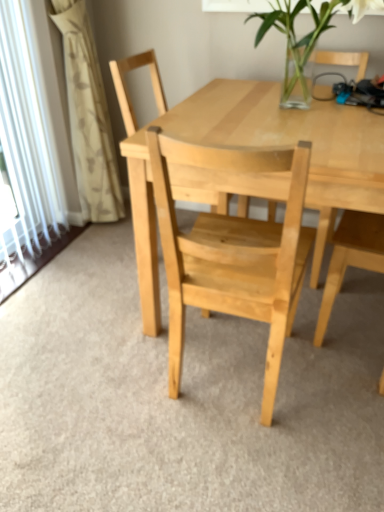
Question: Is natural wood table at center smaller than white textured curtain at left?

Choices:
 (A) no
 (B) yes

Answer: (A)

Question: Is white textured curtain at left completely or partially inside natural wood table at center?

Choices:
 (A) yes
 (B) no

Answer: (B)

Question: Are natural wood table at center and white textured curtain at left making contact?

Choices:
 (A) yes
 (B) no

Answer: (B)

Question: From a real-world perspective, is natural wood table at center beneath white textured curtain at left?

Choices:
 (A) yes
 (B) no

Answer: (A)

Question: Is natural wood table at center bigger than white textured curtain at left?

Choices:
 (A) yes
 (B) no

Answer: (A)

Question: Does point (105, 123) appear closer or farther from the camera than point (291, 58)?

Choices:
 (A) closer
 (B) farther

Answer: (B)

Question: From a real-world perspective, is white textured curtain at left physically located above or below clear glass vase at upper center?

Choices:
 (A) below
 (B) above

Answer: (A)

Question: From the image's perspective, is white textured curtain at left located above or below clear glass vase at upper center?

Choices:
 (A) below
 (B) above

Answer: (A)

Question: From their relative heights in the image, would you say white textured curtain at left is taller or shorter than clear glass vase at upper center?

Choices:
 (A) short
 (B) tall

Answer: (B)

Question: Is natural wood table at center bigger or smaller than clear glass vase at upper center?

Choices:
 (A) big
 (B) small

Answer: (A)

Question: Would you say natural wood table at center is to the left or to the right of clear glass vase at upper center in the picture?

Choices:
 (A) left
 (B) right

Answer: (B)

Question: Considering the positions of natural wood table at center and clear glass vase at upper center in the image, is natural wood table at center taller or shorter than clear glass vase at upper center?

Choices:
 (A) tall
 (B) short

Answer: (A)

Question: Does point (324, 181) appear closer or farther from the camera than point (301, 53)?

Choices:
 (A) closer
 (B) farther

Answer: (A)

Question: Looking at the image, does white textured curtain at left seem bigger or smaller compared to natural wood chair at center?

Choices:
 (A) small
 (B) big

Answer: (A)

Question: Is white textured curtain at left spatially inside natural wood chair at center, or outside of it?

Choices:
 (A) outside
 (B) inside

Answer: (A)